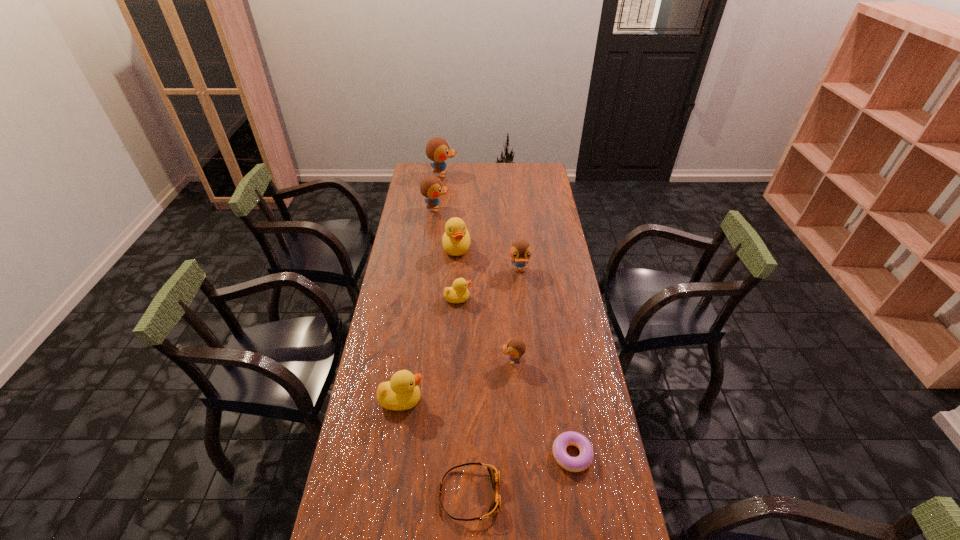
Locate an element on the screen. the sixth farthest duck is located at coordinates (515, 348).

I want to click on the smallest blue duck, so click(x=515, y=348).

Find the location of `the second farthest yellow duck`. the second farthest yellow duck is located at coordinates (459, 293).

Where is `the smallest yellow duck`? This screenshot has height=540, width=960. the smallest yellow duck is located at coordinates (459, 293).

You are a GUI agent. You are given a task and a screenshot of the screen. Output one action in this format:
    pyautogui.click(x=<x>, y=<y>)
    Task: Click on the eighth tallest object
    The height and width of the screenshot is (540, 960).
    Given the screenshot: What is the action you would take?
    pyautogui.click(x=494, y=473)

Where is `the shortest object`? Image resolution: width=960 pixels, height=540 pixels. the shortest object is located at coordinates (580, 463).

At what (x,y) coordinates should I click in order to perform the action: click on vacant space located 0.280m on the front-facing side of the farthest blue duck. Please return your answer as a coordinate pair (x, y). Looking at the image, I should click on (509, 175).

Where is `vacant space located on the front-facing side of the third smallest blue duck`? vacant space located on the front-facing side of the third smallest blue duck is located at coordinates (523, 210).

Identify the location of free spot located 0.160m at the beak of the biggest yellow duck. (454, 287).

This screenshot has width=960, height=540. I want to click on vacant area located on the front-facing side of the second nearest blue duck, so click(x=525, y=328).